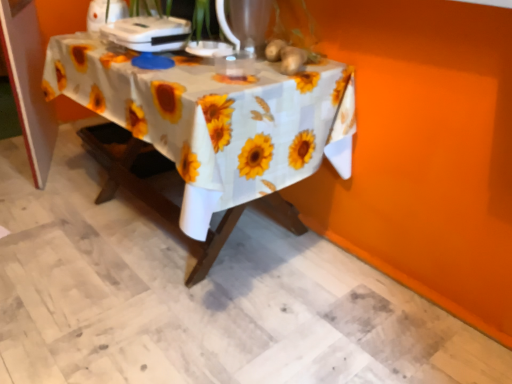
The height and width of the screenshot is (384, 512). In order to click on vacant space situated on the left part of white fabric tablecloth at center in this screenshot , I will do `click(52, 220)`.